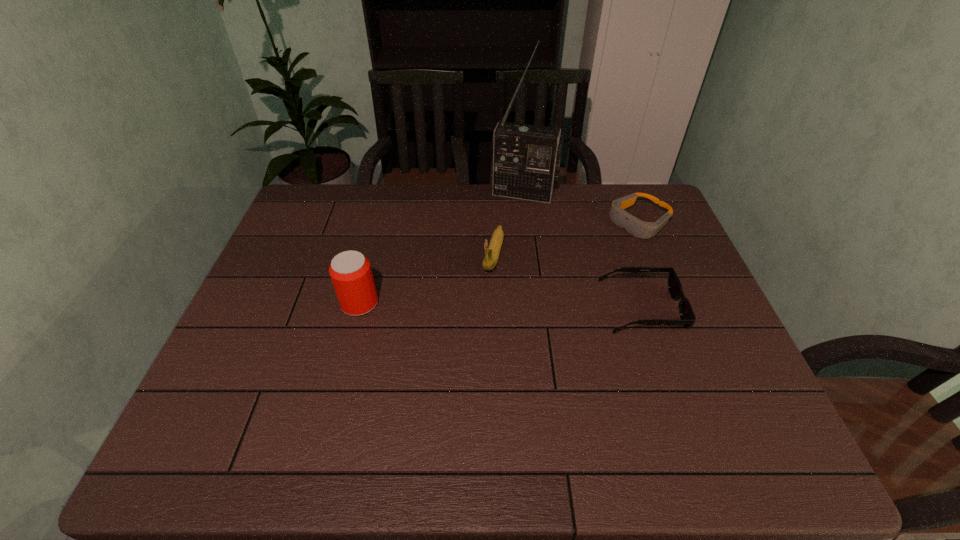
The width and height of the screenshot is (960, 540). Identify the location of unoccupied position between the banana and the second tallest object. (426, 279).

Find the location of a particular element. Image resolution: width=960 pixels, height=540 pixels. free space between the beer can and the goggles is located at coordinates (499, 262).

Locate an element on the screen. The height and width of the screenshot is (540, 960). free space between the sunglasses and the third shortest object is located at coordinates tap(567, 281).

Image resolution: width=960 pixels, height=540 pixels. What are the coordinates of `vacant space that is in between the banana and the goggles` in the screenshot? It's located at (566, 238).

Locate an element on the screen. The width and height of the screenshot is (960, 540). unoccupied position between the tallest object and the goggles is located at coordinates (582, 208).

In order to click on free point between the tallest object and the goggles in this screenshot , I will do `click(582, 208)`.

Locate an element on the screen. This screenshot has height=540, width=960. vacant region between the third shortest object and the second tallest object is located at coordinates (426, 279).

Where is `free point between the second tallest object and the goggles`? free point between the second tallest object and the goggles is located at coordinates (499, 262).

Find the location of a particular element. Image resolution: width=960 pixels, height=540 pixels. object that stands as the second closest to the tallest object is located at coordinates (492, 250).

This screenshot has height=540, width=960. What are the coordinates of `object that is the fourth nearest to the third shortest object` in the screenshot? It's located at (641, 229).